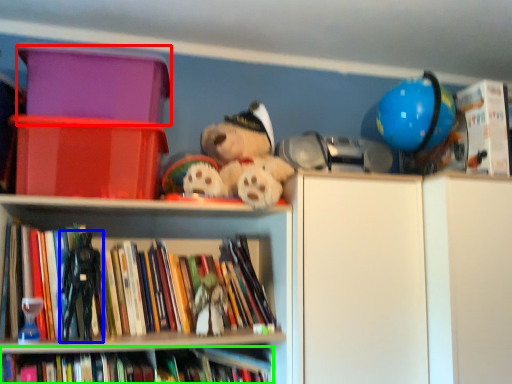
Question: Considering the real-world distances, which object is farthest from storage box (highlighted by a red box)? figurine (highlighted by a blue box) or book (highlighted by a green box)?

Choices:
 (A) figurine
 (B) book

Answer: (B)